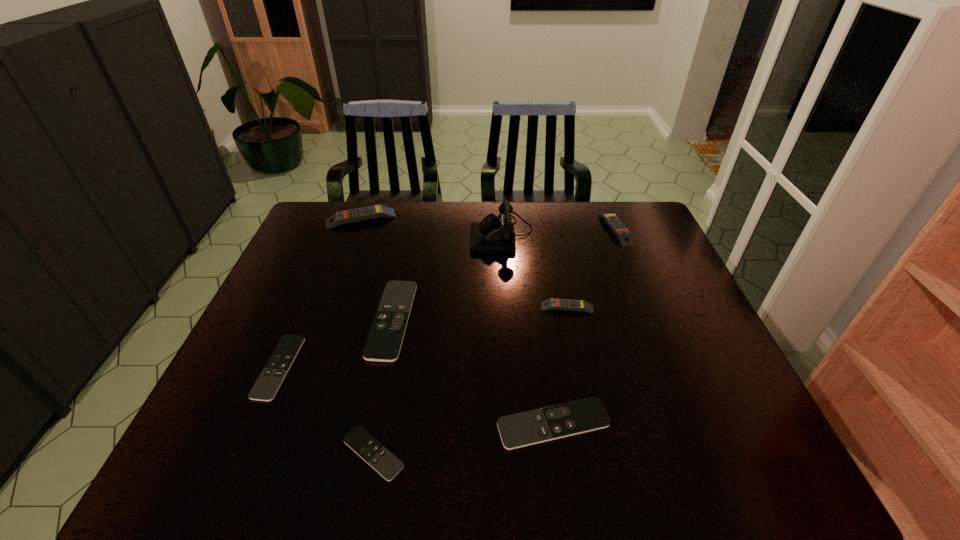
Identify the location of free point between the fourth shortest remote control and the nearest yellow remote control. (480, 314).

Locate an element on the screen. This screenshot has width=960, height=540. free space between the telephone and the shortest object is located at coordinates (438, 343).

Locate an element on the screen. This screenshot has height=540, width=960. free space that is in between the telephone and the tallest remote control is located at coordinates (431, 226).

Where is `free space between the biggest black remote control and the rightmost black remote control`? This screenshot has width=960, height=540. free space between the biggest black remote control and the rightmost black remote control is located at coordinates (473, 372).

Image resolution: width=960 pixels, height=540 pixels. I want to click on vacant space that is in between the shortest object and the seventh shortest object, so click(x=367, y=336).

Identify the location of the third closest object to the biggest black remote control. (493, 235).

The height and width of the screenshot is (540, 960). I want to click on object identified as the closest to the rightmost yellow remote control, so click(x=493, y=235).

Choose which remote control is the third nearest neighbor to the second biggest black remote control. Please provide its 2D coordinates. Your answer should be formatted as a tuple, i.e. [(x, y)], where the tuple contains the x and y coordinates of a point satisfying the conditions above.

[(553, 303)]

The image size is (960, 540). Identify the location of the fifth closest remote control to the sixth tallest remote control. (553, 303).

Locate which yellow remote control is the second closest to the smallest yellow remote control. Please provide its 2D coordinates. Your answer should be formatted as a tuple, i.e. [(x, y)], where the tuple contains the x and y coordinates of a point satisfying the conditions above.

[(376, 211)]